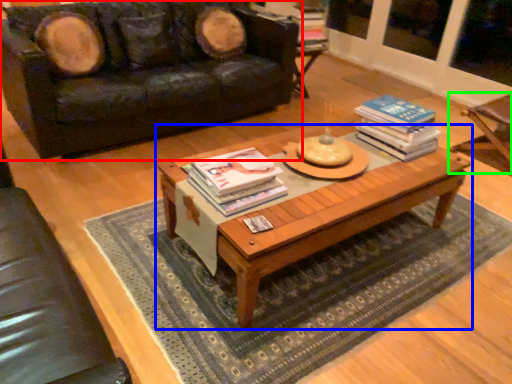
Question: Which object is the farthest from studio couch (highlighted by a red box)? Choose among these: coffee table (highlighted by a blue box) or armchair (highlighted by a green box).

Choices:
 (A) coffee table
 (B) armchair

Answer: (B)